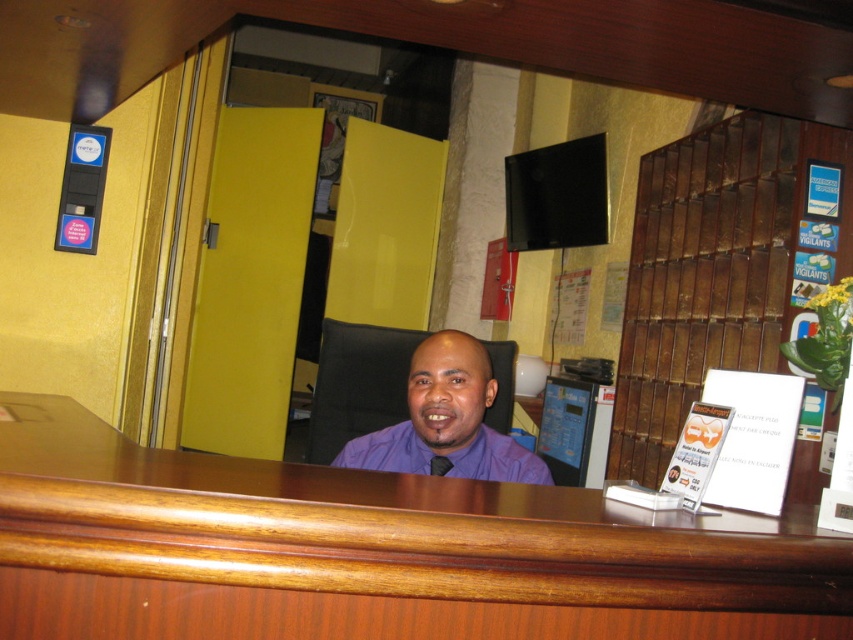
You are standing in the reception area and need to place a small potted plant on the brown wood table at center. According to the coordinates provided, where exactly should you place the plant?

The brown wood table at center is located at coordinates point (370,552), so place the plant there.

In the scene shown: You are standing in the reception area and need to place a small potted plant on the brown wood table at center. According to the coordinates provided, where exactly should you place the plant on the table?

The brown wood table at center is located at coordinates point (370, 552), so you should place the plant there.